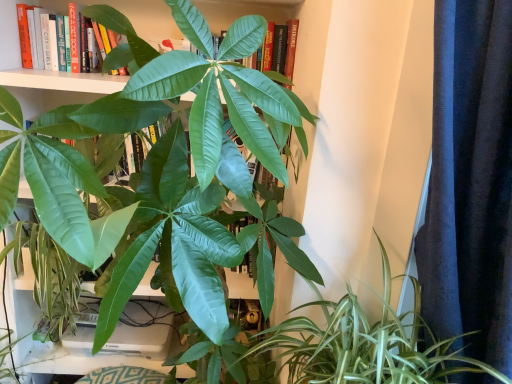
Question: Does green glossy leafy plant at lower right have a lesser height compared to green matte leaf at upper center?

Choices:
 (A) yes
 (B) no

Answer: (B)

Question: Is green glossy leafy plant at lower right not within green matte leaf at upper center?

Choices:
 (A) no
 (B) yes

Answer: (B)

Question: Is green glossy leafy plant at lower right to the left of green matte leaf at upper center from the viewer's perspective?

Choices:
 (A) yes
 (B) no

Answer: (B)

Question: From the image's perspective, is green glossy leafy plant at lower right located beneath green matte leaf at upper center?

Choices:
 (A) no
 (B) yes

Answer: (B)

Question: Would you consider green glossy leafy plant at lower right to be distant from green matte leaf at upper center?

Choices:
 (A) yes
 (B) no

Answer: (B)

Question: Are green glossy leafy plant at lower right and green matte leaf at upper center making contact?

Choices:
 (A) yes
 (B) no

Answer: (B)

Question: Is green matte leaf at upper center located outside green glossy leafy plant at lower right?

Choices:
 (A) yes
 (B) no

Answer: (A)

Question: Could you tell me if green matte leaf at upper center is facing green glossy leafy plant at lower right?

Choices:
 (A) yes
 (B) no

Answer: (B)

Question: Is green matte leaf at upper center facing away from green glossy leafy plant at lower right?

Choices:
 (A) no
 (B) yes

Answer: (A)

Question: Considering the relative sizes of green matte leaf at upper center and green glossy leafy plant at lower right in the image provided, is green matte leaf at upper center thinner than green glossy leafy plant at lower right?

Choices:
 (A) yes
 (B) no

Answer: (A)

Question: From the image's perspective, is green matte leaf at upper center below green glossy leafy plant at lower right?

Choices:
 (A) no
 (B) yes

Answer: (A)

Question: Are green matte leaf at upper center and green glossy leafy plant at lower right making contact?

Choices:
 (A) yes
 (B) no

Answer: (B)

Question: Is green glossy leafy plant at lower right aimed at dark blue textured curtain at right?

Choices:
 (A) yes
 (B) no

Answer: (A)